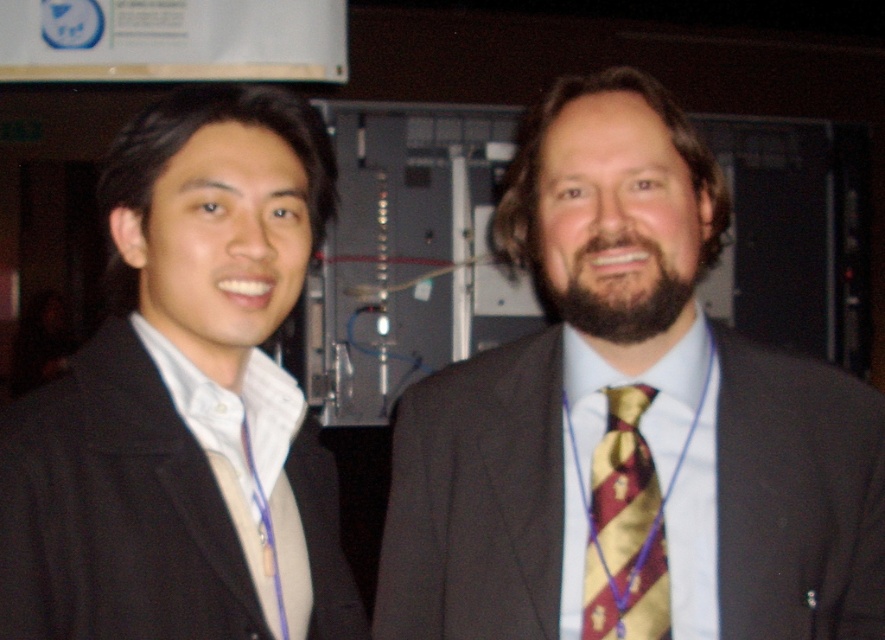
You are at a conference and need to locate the maroon and gold striped tie at center. Based on the coordinates provided, where exactly is it positioned in the image?

The maroon and gold striped tie at center is located at point coordinates of 0.656 on the x axis and 0.711 on the y axis.

You are a photographer at a conference. You need to focus your camera on the black matte suit at left and the maroon striped tie at center. Which one should you adjust the focus for first if you want to ensure both are in sharp focus?

The black matte suit at left is closer to the viewer than the maroon striped tie at center, so you should focus on the black matte suit at left first. This way, the focus will naturally extend to the maroon striped tie at center as it is further away.

From the picture: You are organizing a closet and need to place the black matte suit at left and the maroon striped tie at center. Given their sizes, which one requires more horizontal space when hanging?

The black matte suit at left requires more horizontal space when hanging because its width is larger than the maroon striped tie at center.